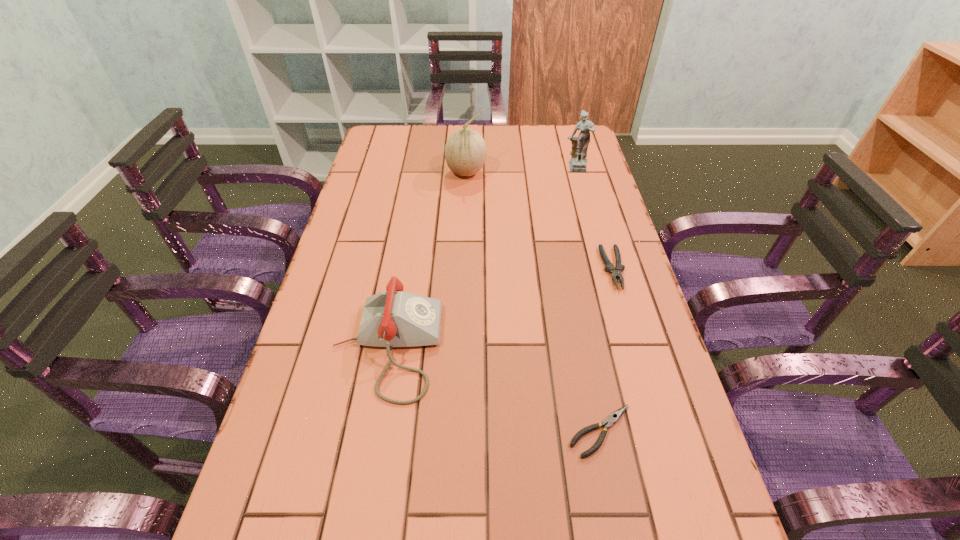
Locate which object ranks fourth in proximity to the figurine. Please provide its 2D coordinates. Your answer should be formatted as a tuple, i.e. [(x, y)], where the tuple contains the x and y coordinates of a point satisfying the conditions above.

[(610, 420)]

Locate an element on the screen. vacant space that satisfies the following two spatial constraints: 1. on the back side of the left pliers; 2. on the dial of the telephone is located at coordinates (585, 347).

Identify the location of free space that satisfies the following two spatial constraints: 1. on the dial of the third tallest object; 2. on the left side of the shorter pliers. This screenshot has height=540, width=960. (372, 431).

Locate an element on the screen. This screenshot has width=960, height=540. free space that satisfies the following two spatial constraints: 1. on the dial of the telephone; 2. on the left side of the shortest object is located at coordinates (372, 431).

Identify the location of free location that satisfies the following two spatial constraints: 1. on the front-facing side of the figurine; 2. on the dial of the third tallest object. This screenshot has width=960, height=540. (623, 347).